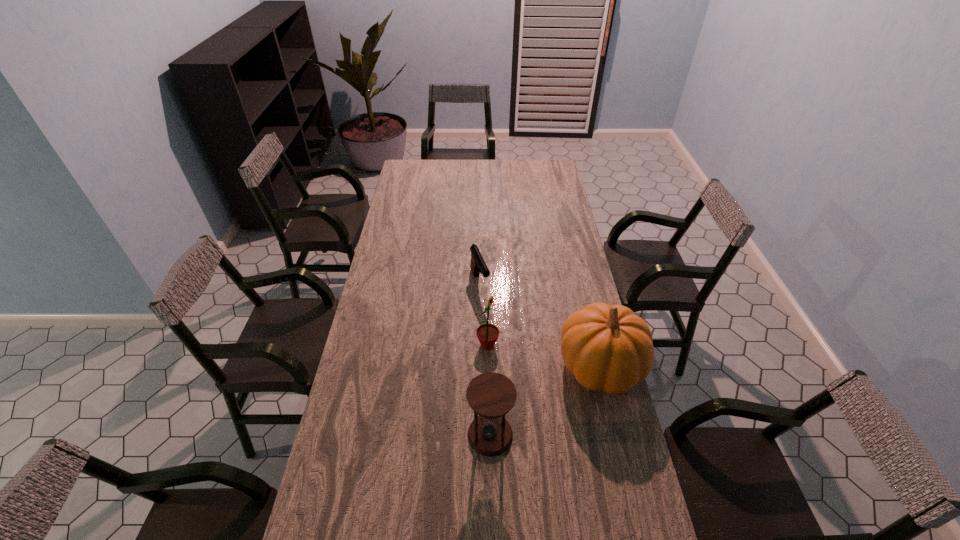
Where is `free spot between the rightmost object and the sunflower`? This screenshot has height=540, width=960. free spot between the rightmost object and the sunflower is located at coordinates (544, 356).

Image resolution: width=960 pixels, height=540 pixels. Find the location of `vacant area between the nearest object and the farthest object`. vacant area between the nearest object and the farthest object is located at coordinates (485, 359).

I want to click on free space that is in between the rightmost object and the farthest object, so click(x=540, y=325).

The image size is (960, 540). Identify the location of free space between the nearest object and the rightmost object. (545, 401).

This screenshot has width=960, height=540. What are the coordinates of `free point between the rightmost object and the sunflower` in the screenshot? It's located at (544, 356).

Identify which object is the nearest to the pumpkin. Please provide its 2D coordinates. Your answer should be formatted as a tuple, i.e. [(x, y)], where the tuple contains the x and y coordinates of a point satisfying the conditions above.

[(491, 395)]

Locate an element on the screen. Image resolution: width=960 pixels, height=540 pixels. the third closest object to the hourglass is located at coordinates (478, 265).

In order to click on blank space that satisfies the following two spatial constraints: 1. on the front side of the rightmost object; 2. on the right side of the pistol in this screenshot , I will do `click(479, 367)`.

In order to click on vacant space that satisfies the following two spatial constraints: 1. on the back side of the pumpkin; 2. on the right side of the hourglass in this screenshot , I will do `click(489, 367)`.